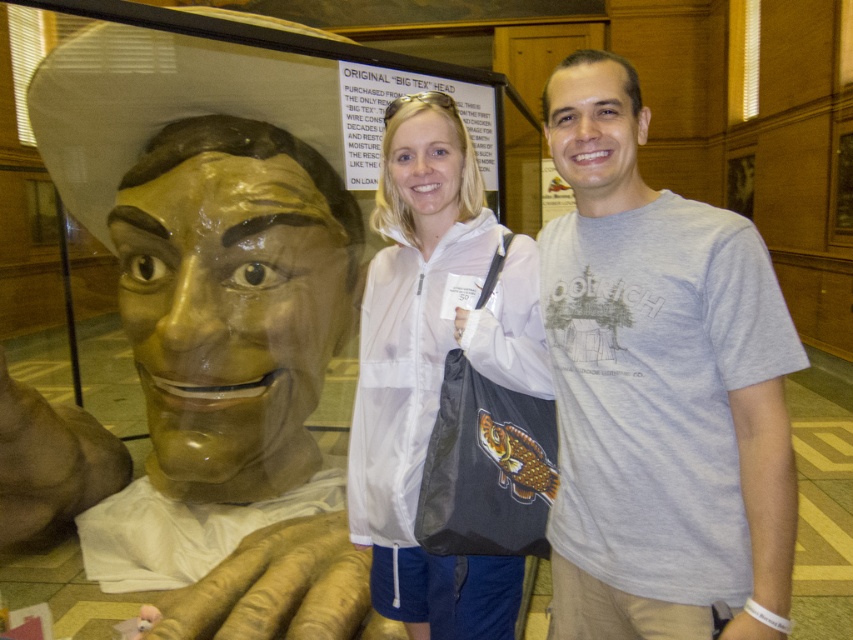
Question: Considering the relative positions of gray cotton t-shirt at right and white matte jacket at center in the image provided, where is gray cotton t-shirt at right located with respect to white matte jacket at center?

Choices:
 (A) below
 (B) above

Answer: (B)

Question: Can you confirm if gray cotton t-shirt at right is smaller than white matte jacket at center?

Choices:
 (A) no
 (B) yes

Answer: (A)

Question: Which of the following is the closest to the observer?

Choices:
 (A) gray cotton t-shirt at right
 (B) white matte jacket at center

Answer: (A)

Question: Which of the following is the closest to the observer?

Choices:
 (A) gray cotton t-shirt at right
 (B) white matte jacket at center

Answer: (A)

Question: Is the position of gray cotton t-shirt at right less distant than that of white matte jacket at center?

Choices:
 (A) yes
 (B) no

Answer: (A)